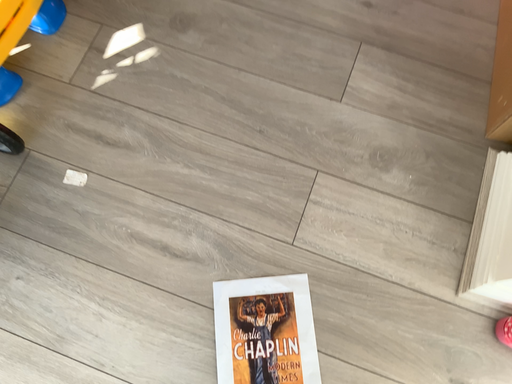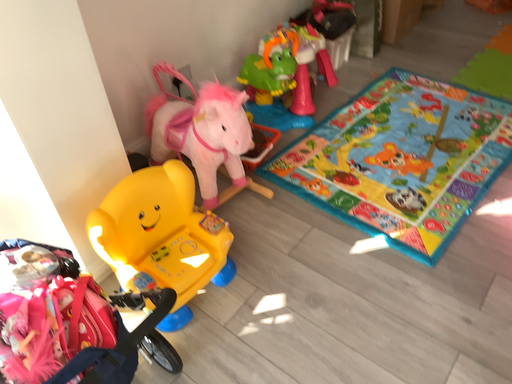
Question: Which way did the camera rotate in the video?

Choices:
 (A) rotated downward
 (B) rotated upward

Answer: (B)